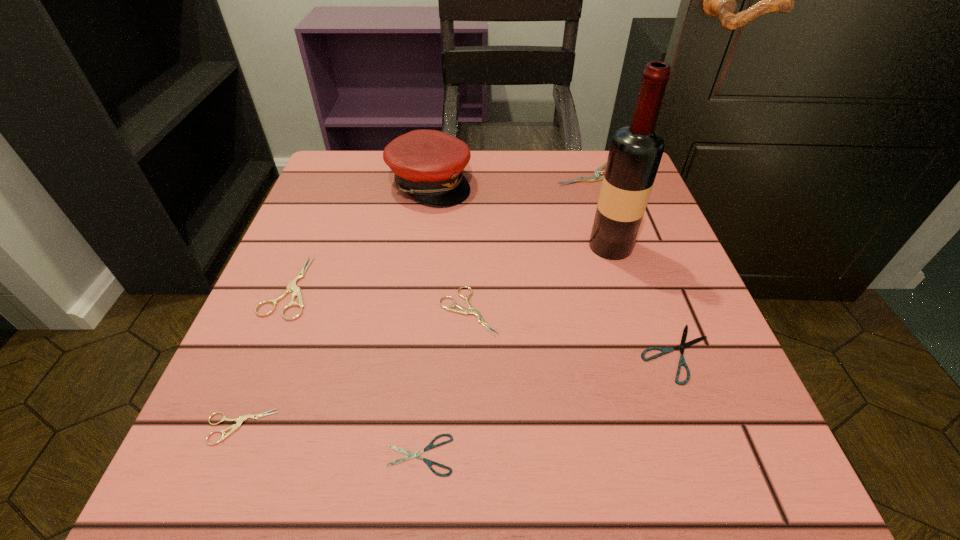
The width and height of the screenshot is (960, 540). What are the coordinates of `vacant region located on the left of the farther black shears` in the screenshot? It's located at (502, 353).

Image resolution: width=960 pixels, height=540 pixels. What are the coordinates of `vacant space situated 0.320m on the right of the smaller black shears` in the screenshot? It's located at (704, 455).

The height and width of the screenshot is (540, 960). Identify the location of cap that is at the far edge. (428, 164).

Find the location of `shears positioned at the far edge`. shears positioned at the far edge is located at coordinates (596, 176).

Image resolution: width=960 pixels, height=540 pixels. In order to click on cap positioned at the left edge in this screenshot , I will do `click(428, 164)`.

This screenshot has width=960, height=540. I want to click on wine bottle positioned at the right edge, so click(635, 153).

The image size is (960, 540). I want to click on object present at the far left corner, so click(x=428, y=164).

Where is `object present at the near left corner`? object present at the near left corner is located at coordinates (239, 420).

This screenshot has width=960, height=540. What are the coordinates of `object situated at the far right corner` in the screenshot? It's located at (596, 176).

In the image, there is a desktop. What are the coordinates of `free space at the far edge` in the screenshot? It's located at (529, 176).